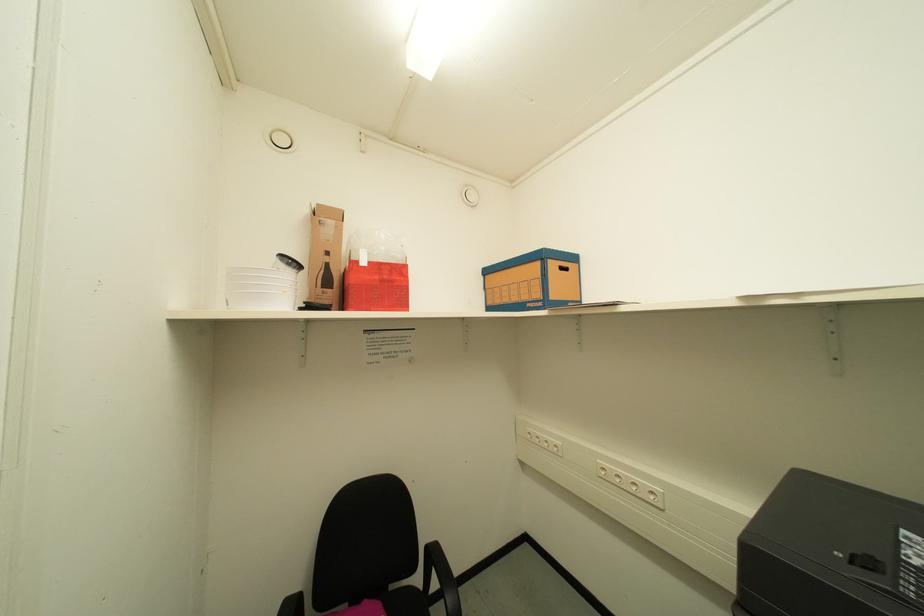
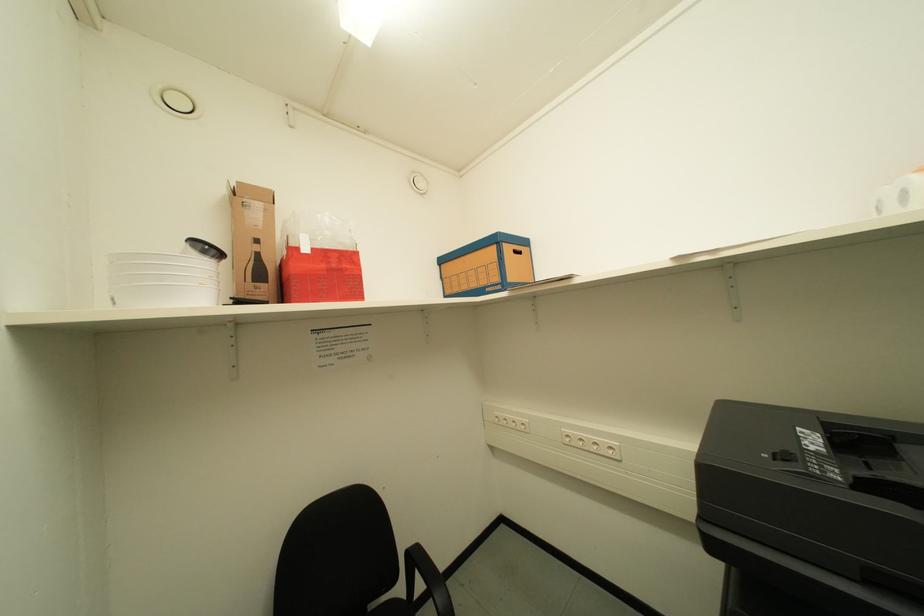
Question: The first image is from the beginning of the video and the second image is from the end. How did the camera likely rotate when shooting the video?

Choices:
 (A) Left
 (B) Right
 (C) Up
 (D) Down

Answer: (B)